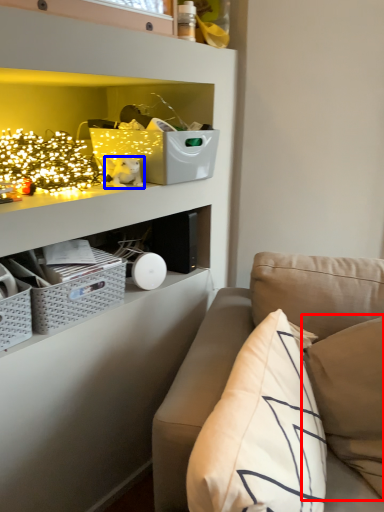
Question: Which object is further to the camera taking this photo, pillow (highlighted by a red box) or toy (highlighted by a blue box)?

Choices:
 (A) pillow
 (B) toy

Answer: (B)